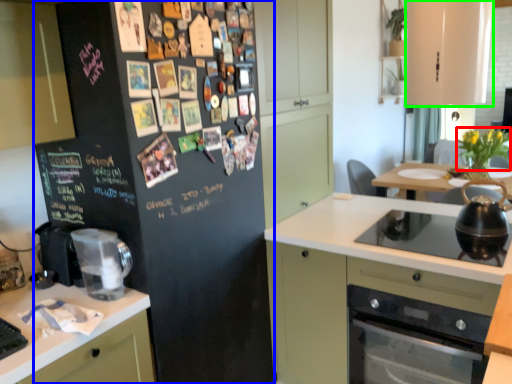
Question: Which is nearer to the flower (highlighted by a red box)? refrigerator (highlighted by a blue box) or cabinetry (highlighted by a green box).

Choices:
 (A) refrigerator
 (B) cabinetry

Answer: (B)